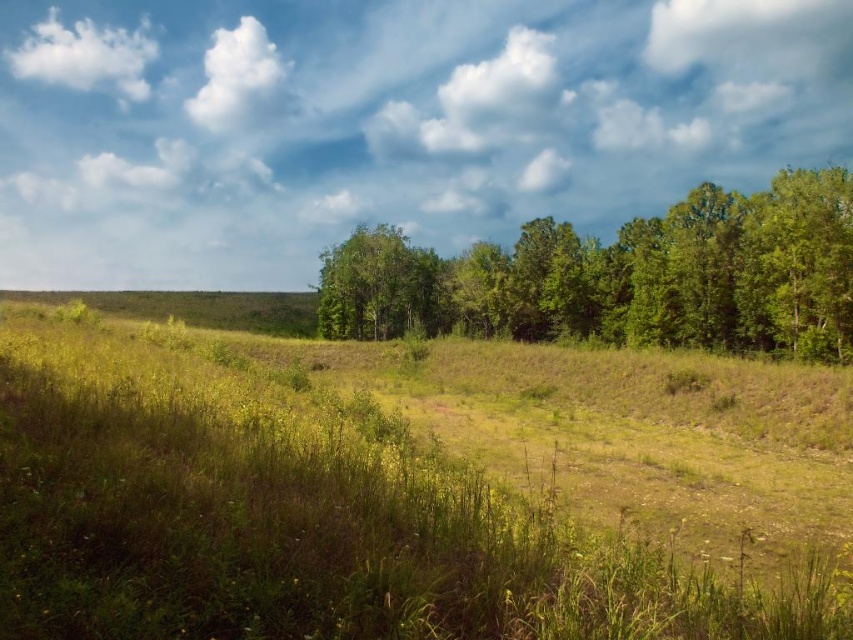
You are an artist trying to paint the rural landscape. You want to ensure the green leafy trees at center and the white fluffy cloud at upper left are proportionally accurate. Which object should you paint larger?

The green leafy trees at center should be painted larger because they are described as having a larger size compared to the white fluffy cloud at upper left.

You are a landscape architect designing a walking path through this rural area. The path must pass between the green leafy trees at center and the green leafy tree at center. What is the minimum width the path should be to ensure there is at least 10 feet of clearance on both sides of the path?

The distance between the green leafy trees at center and the green leafy tree at center is 41.26 feet. To ensure at least 10 feet of clearance on both sides, the path should be 41.26 minus 20 feet, which equals 21.26 feet wide.

Consider the image. You are standing at the origin point of the image. Which direction should you walk to reach the green leafy trees at center?

You should walk towards the direction of point (624,276) to reach the green leafy trees at center.